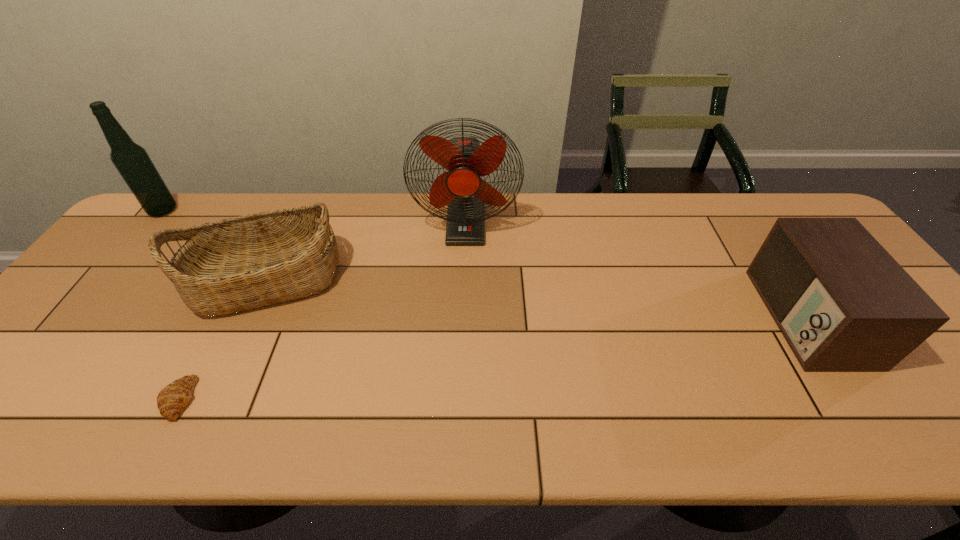
Find the location of `vacant area located 0.140m on the front-facing side of the rightmost object`. vacant area located 0.140m on the front-facing side of the rightmost object is located at coordinates click(x=708, y=317).

Identify the location of vacant area situated on the front-facing side of the rightmost object. (612, 317).

You are a GUI agent. You are given a task and a screenshot of the screen. Output one action in this format:
    pyautogui.click(x=<x>, y=<y>)
    Task: Click on the free space located 0.250m on the right of the shortest object
    The height and width of the screenshot is (540, 960).
    Given the screenshot: What is the action you would take?
    pyautogui.click(x=312, y=399)

Find the location of `fan at the far edge`. fan at the far edge is located at coordinates (466, 160).

Locate an element on the screen. alcohol located at the far edge is located at coordinates point(131,160).

Identify the location of object located in the near edge section of the desktop. point(171,400).

I want to click on object at the left edge, so click(131, 160).

You are a GUI agent. You are given a task and a screenshot of the screen. Output one action in this format:
    pyautogui.click(x=<x>, y=<y>)
    Task: Click on the object positioned at the right edge
    
    Given the screenshot: What is the action you would take?
    pyautogui.click(x=842, y=302)

Locate an element on the screen. object that is at the far left corner is located at coordinates (131, 160).

In the image, there is a desktop. Where is `vacant region at the far edge`? This screenshot has height=540, width=960. vacant region at the far edge is located at coordinates (756, 219).